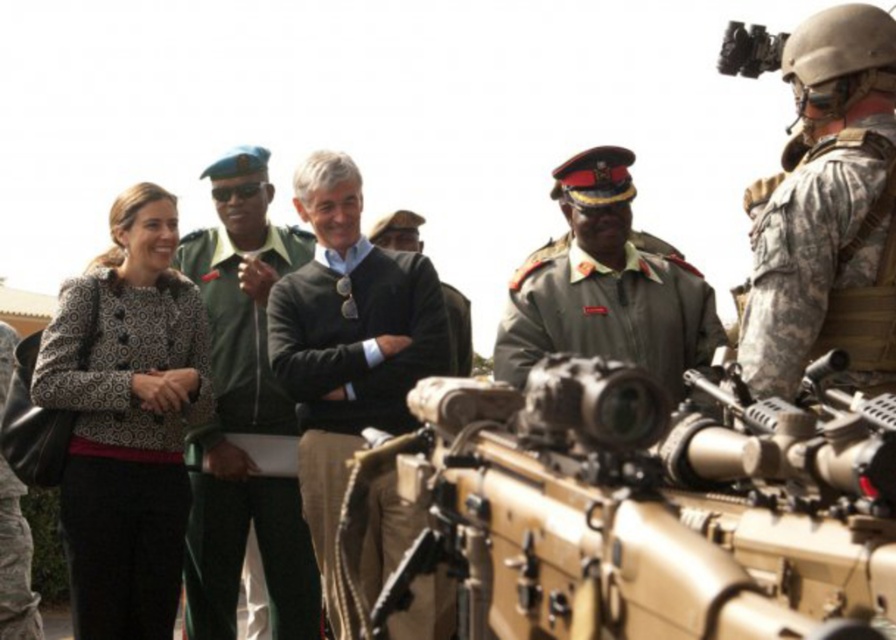
Question: Is patterned fabric coat at center below green military uniform at center?

Choices:
 (A) no
 (B) yes

Answer: (B)

Question: Which is nearer to the patterned fabric coat at center?

Choices:
 (A) green military uniform at center
 (B) black matte uniform at left

Answer: (B)

Question: Among these objects, which one is nearest to the camera?

Choices:
 (A) green uniform at center
 (B) camouflage uniform at right
 (C) green military uniform at center

Answer: (C)

Question: Is patterned fabric coat at center thinner than green uniform at center?

Choices:
 (A) no
 (B) yes

Answer: (B)

Question: Based on their relative distances, which object is farther from the black matte uniform at left?

Choices:
 (A) patterned fabric coat at center
 (B) green military uniform at center

Answer: (B)

Question: Is tan matte rifle at center to the right of camouflage uniform at right from the viewer's perspective?

Choices:
 (A) yes
 (B) no

Answer: (B)